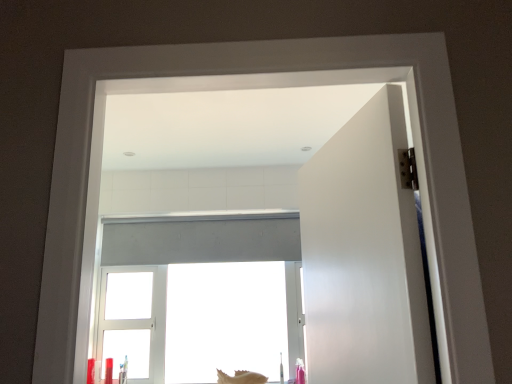
Question: Considering the relative positions of white matte door at right and white matte window at center in the image provided, is white matte door at right to the left of white matte window at center from the viewer's perspective?

Choices:
 (A) no
 (B) yes

Answer: (A)

Question: Is white matte door at right to the right of white matte window at center from the viewer's perspective?

Choices:
 (A) yes
 (B) no

Answer: (A)

Question: Are white matte door at right and white matte window at center far apart?

Choices:
 (A) no
 (B) yes

Answer: (B)

Question: Is white matte door at right bigger than white matte window at center?

Choices:
 (A) yes
 (B) no

Answer: (B)

Question: Does white matte door at right have a lesser width compared to white matte window at center?

Choices:
 (A) yes
 (B) no

Answer: (B)

Question: Is white matte door at right inside or outside of smooth beige seashell at lower center?

Choices:
 (A) outside
 (B) inside

Answer: (A)

Question: In the image, is white matte door at right positioned in front of or behind smooth beige seashell at lower center?

Choices:
 (A) front
 (B) behind

Answer: (A)

Question: Considering the positions of white matte door at right and smooth beige seashell at lower center in the image, is white matte door at right wider or thinner than smooth beige seashell at lower center?

Choices:
 (A) wide
 (B) thin

Answer: (A)

Question: From the image's perspective, is white matte door at right above or below smooth beige seashell at lower center?

Choices:
 (A) above
 (B) below

Answer: (A)

Question: Considering their positions, is white matte window at center located in front of or behind white matte door at right?

Choices:
 (A) front
 (B) behind

Answer: (B)

Question: Is white matte window at center situated inside white matte door at right or outside?

Choices:
 (A) outside
 (B) inside

Answer: (A)

Question: From the image's perspective, relative to white matte door at right, is white matte window at center above or below?

Choices:
 (A) below
 (B) above

Answer: (A)

Question: Is white matte window at center bigger or smaller than white matte door at right?

Choices:
 (A) big
 (B) small

Answer: (A)

Question: Is point (266, 377) closer or farther from the camera than point (249, 215)?

Choices:
 (A) closer
 (B) farther

Answer: (A)

Question: From a real-world perspective, is smooth beige seashell at lower center above or below white matte window at center?

Choices:
 (A) above
 (B) below

Answer: (B)